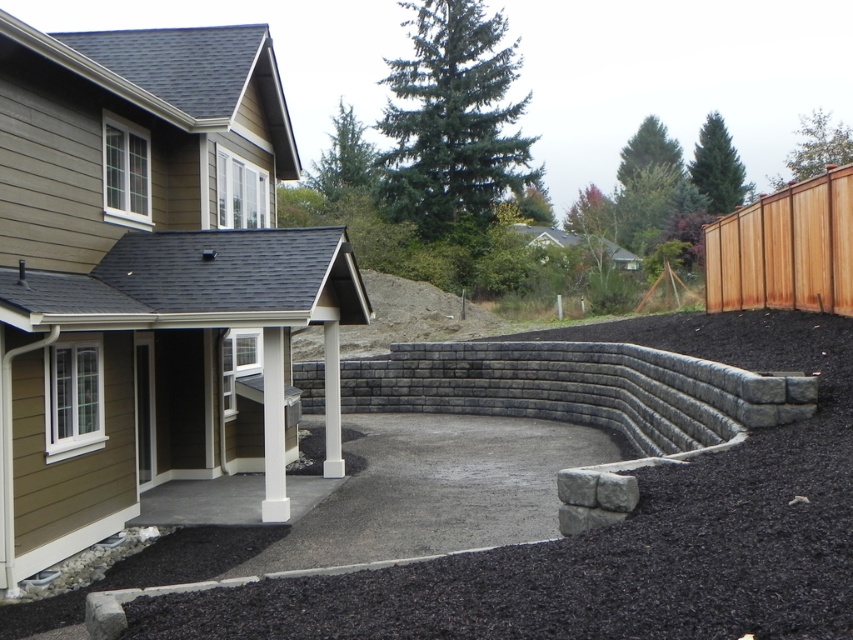
Can you confirm if gray concrete patio at center is taller than brown wood fence at upper right?

Indeed, gray concrete patio at center has a greater height compared to brown wood fence at upper right.

Which is behind, point (260, 86) or point (838, 285)?

The point (260, 86) is behind.

Between point (82, 515) and point (805, 296), which one is positioned in front?

Point (82, 515) is in front.

Image resolution: width=853 pixels, height=640 pixels. Find the location of `gray concrete patio at center`. gray concrete patio at center is located at coordinates (149, 278).

Is gray concrete patio at center wider than black gravel at lower center?

No.

Is point (12, 300) more distant than point (751, 323)?

That is False.

Locate an element on the screen. This screenshot has width=853, height=640. gray concrete patio at center is located at coordinates (149, 278).

Can you confirm if black gravel at lower center is bigger than brown wood fence at upper right?

Correct, black gravel at lower center is larger in size than brown wood fence at upper right.

Can you confirm if black gravel at lower center is positioned to the left of brown wood fence at upper right?

Indeed, black gravel at lower center is positioned on the left side of brown wood fence at upper right.

Where is `black gravel at lower center`? The image size is (853, 640). black gravel at lower center is located at coordinates (622, 532).